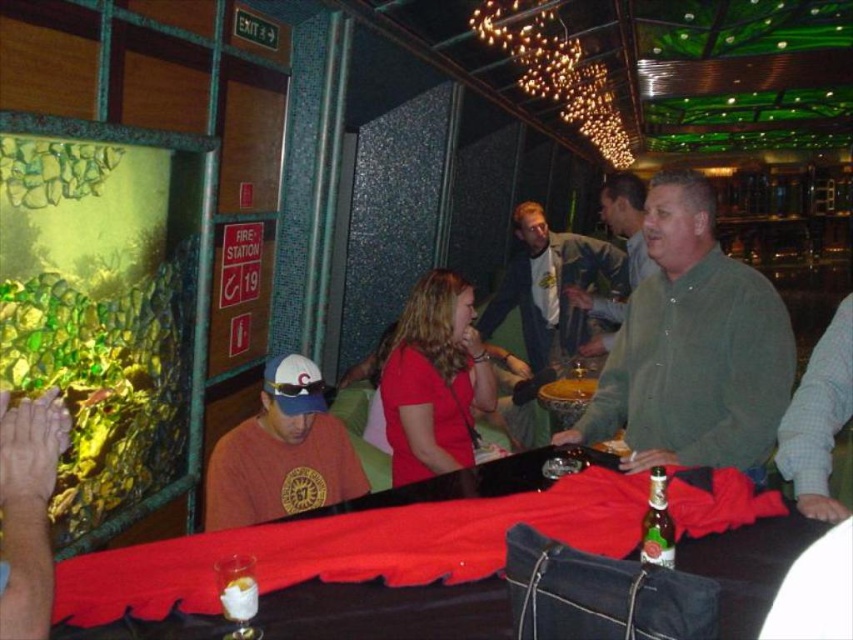
Who is shorter, matte orange shirt at center or green glass bottle at lower center?

green glass bottle at lower center is shorter.

Does matte orange shirt at center have a smaller size compared to green glass bottle at lower center?

Incorrect, matte orange shirt at center is not smaller in size than green glass bottle at lower center.

Image resolution: width=853 pixels, height=640 pixels. Find the location of `matte orange shirt at center`. matte orange shirt at center is located at coordinates (281, 452).

Image resolution: width=853 pixels, height=640 pixels. I want to click on matte orange shirt at center, so (281, 452).

Is green corduroy shirt at center wider than matte orange shirt at center?

Indeed, green corduroy shirt at center has a greater width compared to matte orange shirt at center.

Is green corduroy shirt at center above matte orange shirt at center?

Yes, green corduroy shirt at center is above matte orange shirt at center.

At what (x,y) coordinates should I click in order to perform the action: click on green corduroy shirt at center. Please return your answer as a coordinate pair (x, y). This screenshot has width=853, height=640. Looking at the image, I should click on (693, 348).

Is matte red shirt at center to the left of green cotton shirt at center from the viewer's perspective?

Yes, matte red shirt at center is to the left of green cotton shirt at center.

Is point (418, 403) closer to camera compared to point (485, 333)?

Yes, it is in front of point (485, 333).

Find the location of a particular element. matte red shirt at center is located at coordinates (434, 380).